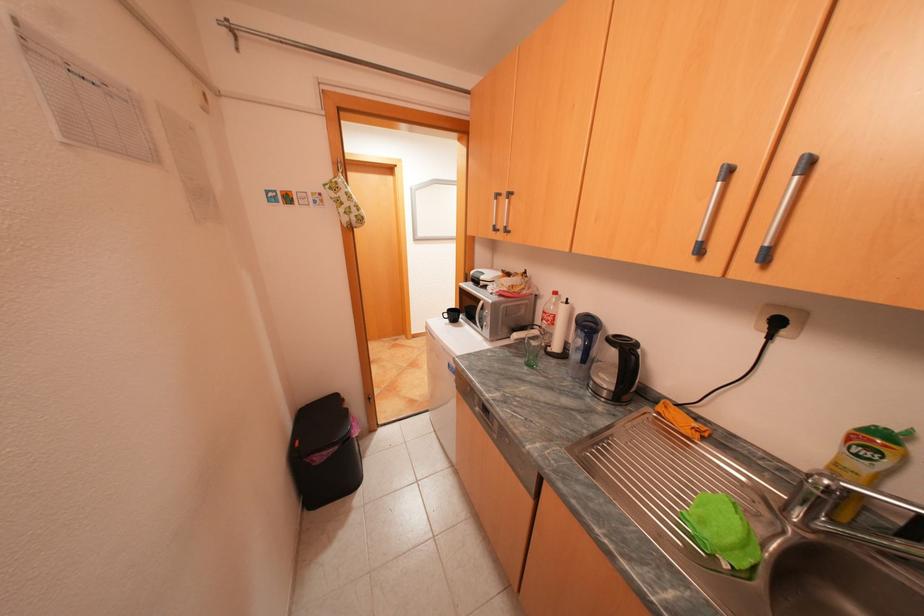
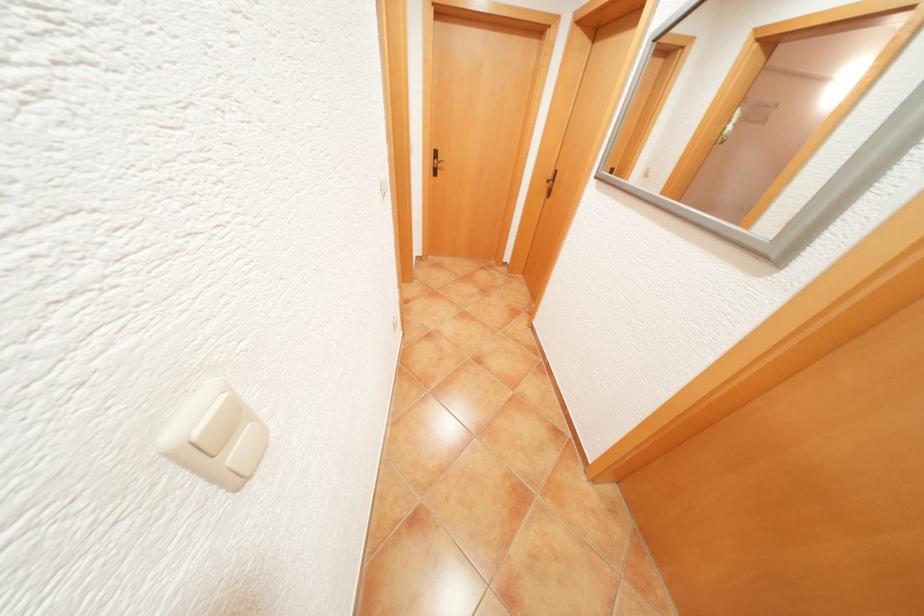
Question: I am providing you with two images of the same scene from different viewpoints. Which of the following objects are not visible in image2?

Choices:
 (A) blue soda can
 (B) light switch rocker
 (C) black door handle
 (D) silver cabinet handle

Answer: (D)